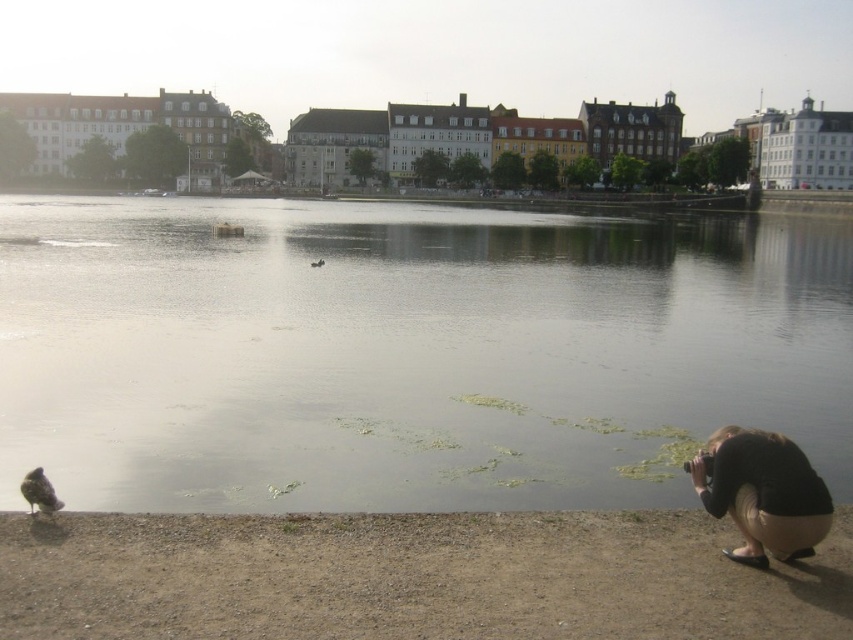
You are a photographer who wants to capture both the black fabric squat at lower right and the brown feathered bird at center in the same frame. Considering their heights, which object should you focus on first to ensure both are in focus?

The black fabric squat at lower right has a greater height compared to the brown feathered bird at center. To ensure both are in focus, you should focus on the taller object first, which is the black fabric squat at lower right.